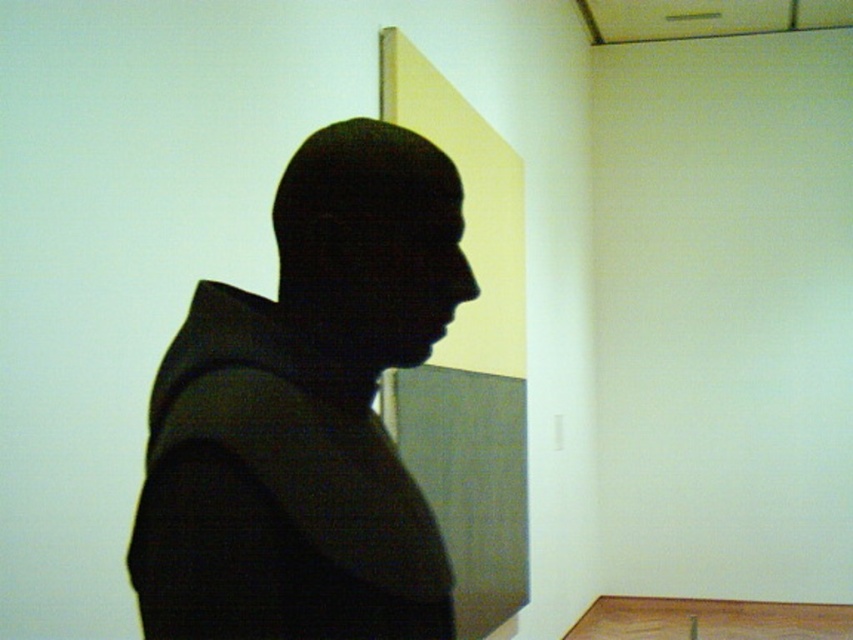
Is the position of black matte bust at center less distant than that of black matte head at center?

Yes, it is in front of black matte head at center.

Is point (201, 529) positioned in front of point (424, 344)?

Yes.

Find the location of a particular element. The height and width of the screenshot is (640, 853). black matte bust at center is located at coordinates (306, 413).